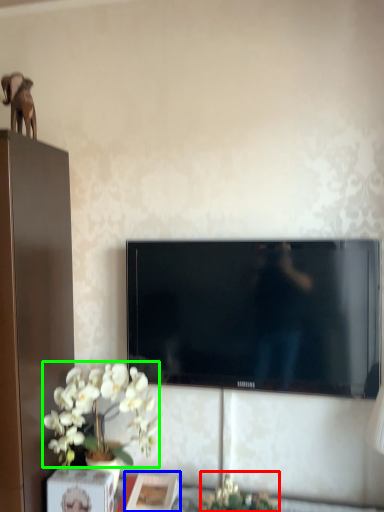
Question: Considering the real-world distances, which object is farthest from plant (highlighted by a red box)? picture frame (highlighted by a blue box) or flower (highlighted by a green box)?

Choices:
 (A) picture frame
 (B) flower

Answer: (B)